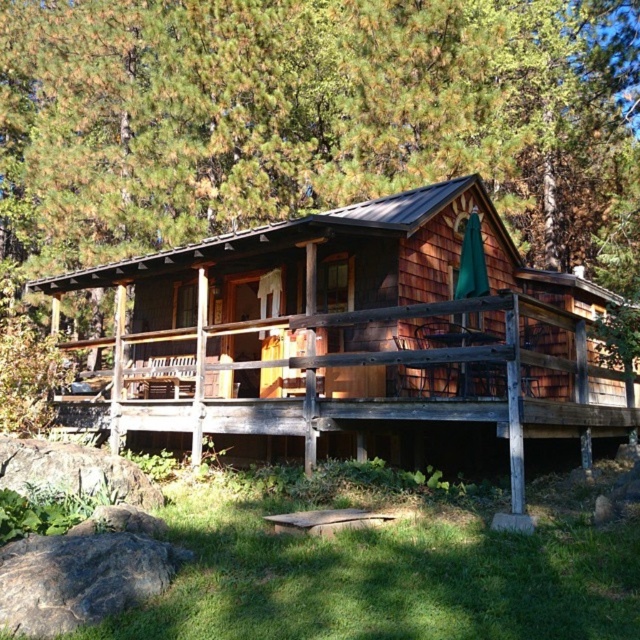
In the scene shown: You are an architect evaluating the cabin for potential renovations. You notice the green shingles at upper center and the weathered wood porch at center. Which of these two elements has a more prominent visual presence in the design?

The green shingles at upper center has a larger size compared to the weathered wood porch at center, making it more visually prominent in the design.

You are standing in front of the cabin and notice a specific point marked at coordinates point (314, 120). What object is located at this point?

The green shingles at upper center are located at point (314, 120).

You are standing on the weathered wood porch at center of the rustic wooden cabin. Looking up, you notice the green shingles at upper center. Based on the scene, where exactly are the green shingles located in relation to the porch?

The green shingles at upper center are positioned over the weathered wood porch at center, meaning they are part of the cabin roof that covers the porch area.